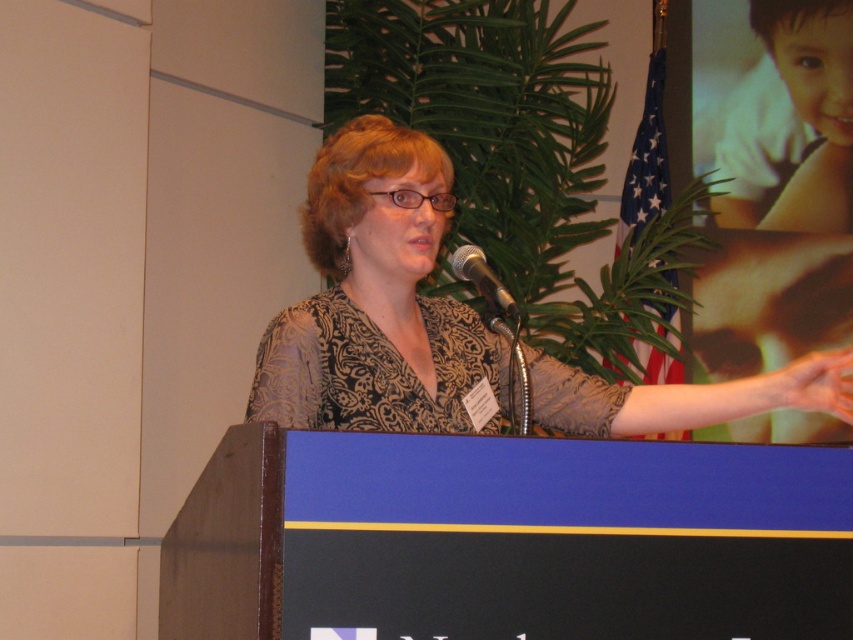
Question: Does patterned fabric woman at center appear over metallic silver microphone at center?

Choices:
 (A) no
 (B) yes

Answer: (A)

Question: Can you confirm if patterned fabric woman at center is positioned to the right of metallic silver microphone at center?

Choices:
 (A) no
 (B) yes

Answer: (B)

Question: Which of the following is the closest to the observer?

Choices:
 (A) (498, 284)
 (B) (722, 412)

Answer: (A)

Question: Among these objects, which one is farthest from the camera?

Choices:
 (A) patterned fabric woman at center
 (B) metallic silver microphone at center

Answer: (B)

Question: Does patterned fabric woman at center lie behind metallic silver microphone at center?

Choices:
 (A) yes
 (B) no

Answer: (B)

Question: Among these objects, which one is farthest from the camera?

Choices:
 (A) metallic silver microphone at center
 (B) patterned fabric woman at center

Answer: (A)